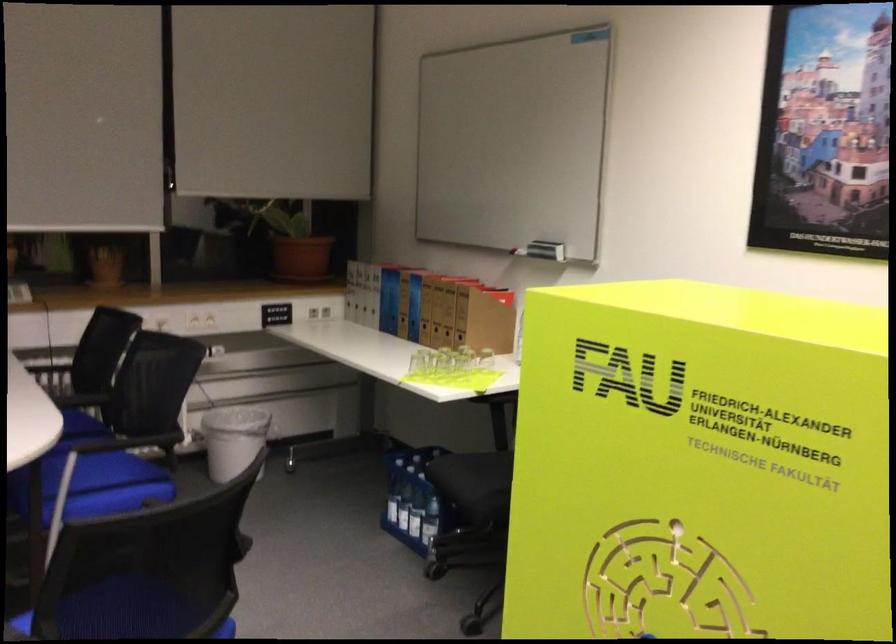
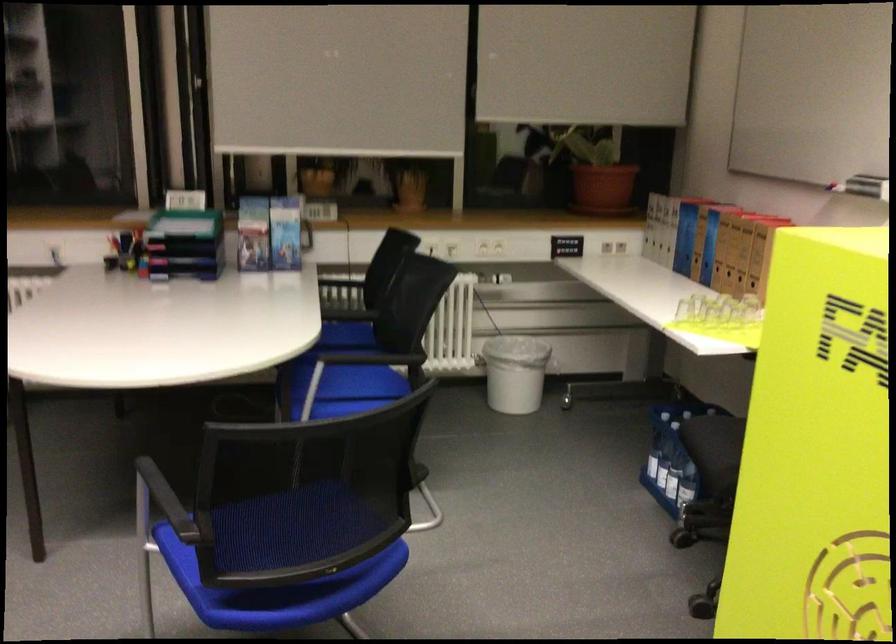
The point at [391,301] is marked in the first image. Where is the corresponding point in the second image?

(685, 238)